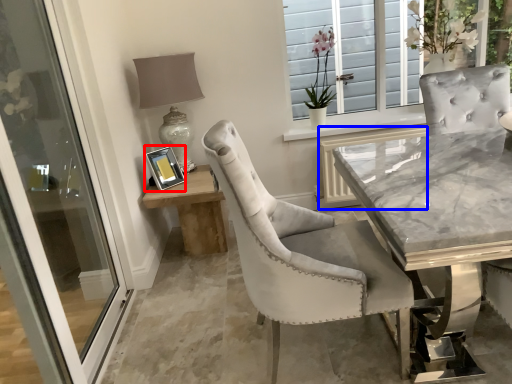
Question: Which point is further to the camera, picture frame (highlighted by a red box) or shutter (highlighted by a blue box)?

Choices:
 (A) picture frame
 (B) shutter

Answer: (B)